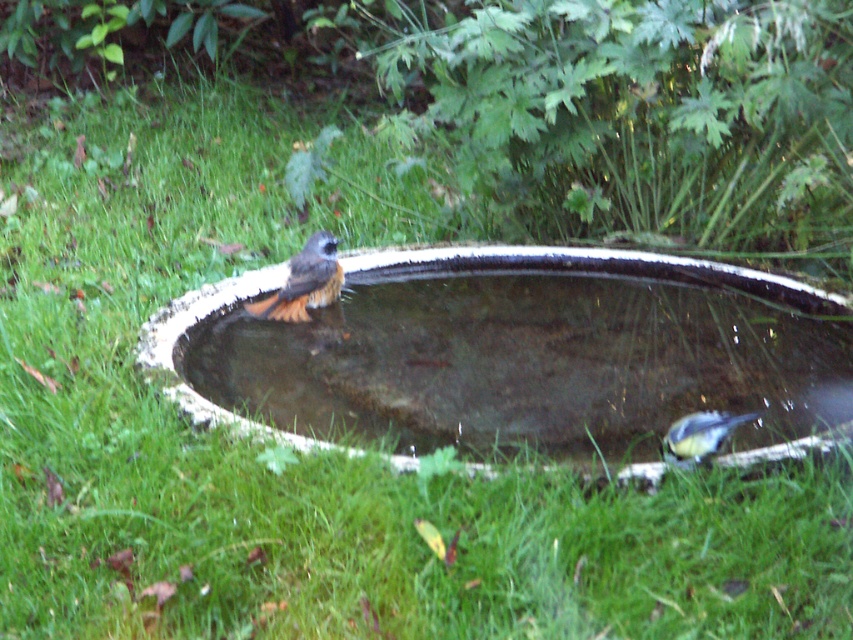
Question: Among these points, which one is farthest from the camera?

Choices:
 (A) (846, 307)
 (B) (711, 452)
 (C) (325, 266)

Answer: (C)

Question: Is brown speckled feathers at center wider than blue-green feathers at lower right?

Choices:
 (A) no
 (B) yes

Answer: (B)

Question: Which point is farther to the camera?

Choices:
 (A) brown speckled feathers at center
 (B) smooth concrete basin at center
 (C) blue-green feathers at lower right

Answer: (A)

Question: Can you confirm if smooth concrete basin at center is wider than blue-green feathers at lower right?

Choices:
 (A) no
 (B) yes

Answer: (B)

Question: Which point is closer to the camera?

Choices:
 (A) (317, 243)
 (B) (660, 259)
 (C) (672, 422)

Answer: (C)

Question: Observing the image, what is the correct spatial positioning of smooth concrete basin at center in reference to brown speckled feathers at center?

Choices:
 (A) right
 (B) left

Answer: (A)